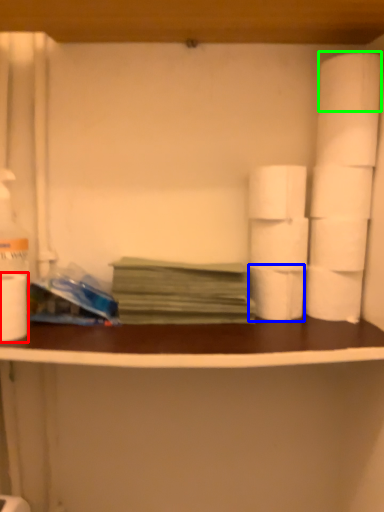
Question: Which object is positioned farthest from toilet paper (highlighted by a red box)? Select from toilet paper (highlighted by a blue box) and toilet paper (highlighted by a green box).

Choices:
 (A) toilet paper
 (B) toilet paper

Answer: (B)